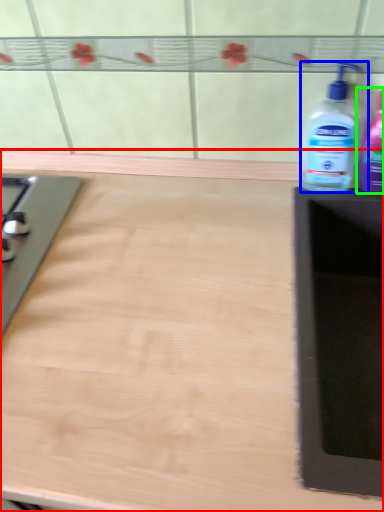
Question: Considering the real-world distances, which object is closest to countertop (highlighted by a red box)? bottle (highlighted by a blue box) or bottle (highlighted by a green box).

Choices:
 (A) bottle
 (B) bottle

Answer: (A)